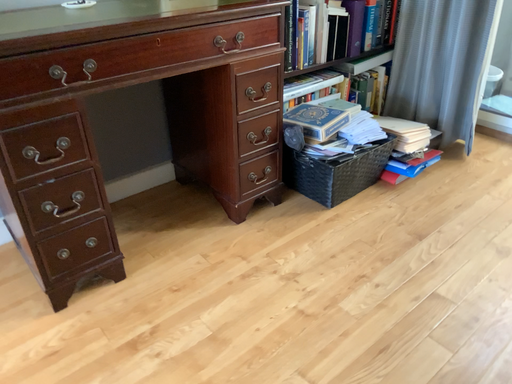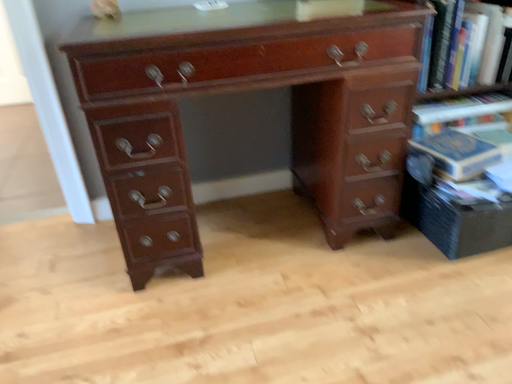
Question: Which way did the camera rotate in the video?

Choices:
 (A) rotated left
 (B) rotated right

Answer: (A)